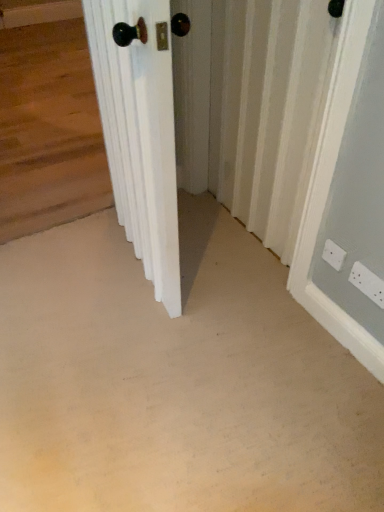
Question: Is beige carpet at center at the back of white plastic electric outlet at lower right, acting as the 2th electric outlet starting from the left?

Choices:
 (A) no
 (B) yes

Answer: (A)

Question: Does white plastic electric outlet at lower right, the 1th electric outlet when ordered from right to left, have a larger size compared to beige carpet at center?

Choices:
 (A) yes
 (B) no

Answer: (B)

Question: From a real-world perspective, is white plastic electric outlet at lower right, acting as the 2th electric outlet starting from the left, on beige carpet at center?

Choices:
 (A) no
 (B) yes

Answer: (B)

Question: Is white plastic electric outlet at lower right, the 1th electric outlet when ordered from right to left, not within beige carpet at center?

Choices:
 (A) no
 (B) yes

Answer: (B)

Question: Considering the relative positions of white plastic electric outlet at lower right, the 1th electric outlet when ordered from right to left, and beige carpet at center in the image provided, is white plastic electric outlet at lower right, the 1th electric outlet when ordered from right to left, behind beige carpet at center?

Choices:
 (A) yes
 (B) no

Answer: (A)

Question: Is white plastic electric outlet at lower right, acting as the 2th electric outlet starting from the left, at the right side of beige carpet at center?

Choices:
 (A) yes
 (B) no

Answer: (A)

Question: Considering the relative sizes of beige carpet at center and white plastic electric outlet at lower right, the second electric outlet from the right, in the image provided, is beige carpet at center smaller than white plastic electric outlet at lower right, the second electric outlet from the right,?

Choices:
 (A) yes
 (B) no

Answer: (B)

Question: Is beige carpet at center not inside white plastic electric outlet at lower right, the second electric outlet from the right?

Choices:
 (A) no
 (B) yes

Answer: (B)

Question: Does beige carpet at center have a lesser width compared to white plastic electric outlet at lower right, the second electric outlet from the right?

Choices:
 (A) yes
 (B) no

Answer: (B)

Question: Is white plastic electric outlet at lower right, which is the first electric outlet in left-to-right order, a part of beige carpet at center?

Choices:
 (A) no
 (B) yes

Answer: (A)

Question: Does beige carpet at center appear on the left side of white plastic electric outlet at lower right, the second electric outlet from the right?

Choices:
 (A) yes
 (B) no

Answer: (A)

Question: Is beige carpet at center directly adjacent to white plastic electric outlet at lower right, which is the first electric outlet in left-to-right order?

Choices:
 (A) yes
 (B) no

Answer: (B)

Question: Is white wooden door at center positioned before white textured radiator at center?

Choices:
 (A) no
 (B) yes

Answer: (B)